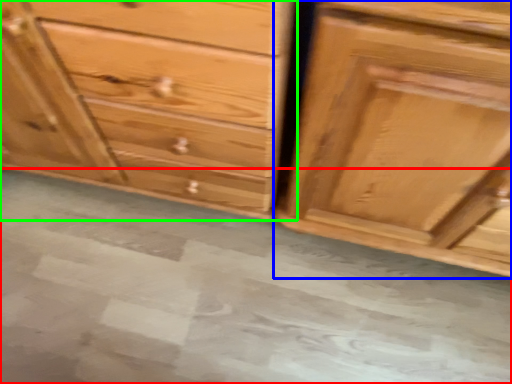
Question: Based on their relative distances, which object is farther from concrete (highlighted by a red box)? Choose from chest of drawers (highlighted by a blue box) and chest of drawers (highlighted by a green box).

Choices:
 (A) chest of drawers
 (B) chest of drawers

Answer: (A)